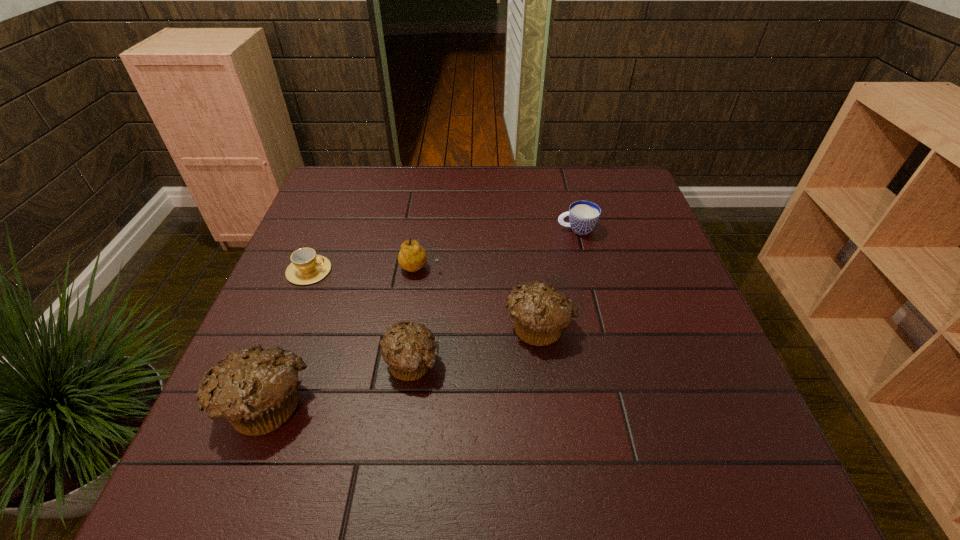
At what (x,y) coordinates should I click in order to perform the action: click on the closest muffin to the fifth object from left to right. Please return your answer as a coordinate pair (x, y). Looking at the image, I should click on (409, 351).

This screenshot has width=960, height=540. What are the coordinates of `free region that satisfies the following two spatial constraints: 1. with the handle on the side of the nearer cup; 2. on the left side of the second shortest muffin` in the screenshot? It's located at (287, 325).

This screenshot has width=960, height=540. I want to click on vacant space that satisfies the following two spatial constraints: 1. with the handle on the side of the shortest object; 2. on the left side of the shortest muffin, so click(272, 361).

Find the location of a particular element. The width and height of the screenshot is (960, 540). blank space that satisfies the following two spatial constraints: 1. on the side of the fifth tallest object with the handle; 2. on the front side of the leftmost muffin is located at coordinates (621, 403).

Locate an element on the screen. This screenshot has width=960, height=540. free location that satisfies the following two spatial constraints: 1. on the back side of the second tallest muffin; 2. with the handle on the side of the shortest object is located at coordinates (532, 271).

This screenshot has width=960, height=540. What are the coordinates of `vacant space that satisfies the following two spatial constraints: 1. on the side of the fifth tallest object with the handle; 2. on the front side of the pear` in the screenshot? It's located at (587, 268).

At what (x,y) coordinates should I click in order to perform the action: click on vacant space that satisfies the following two spatial constraints: 1. with the handle on the side of the shorter cup; 2. on the right side of the second object from right to left. Please return your answer as a coordinate pair (x, y). Looking at the image, I should click on (287, 325).